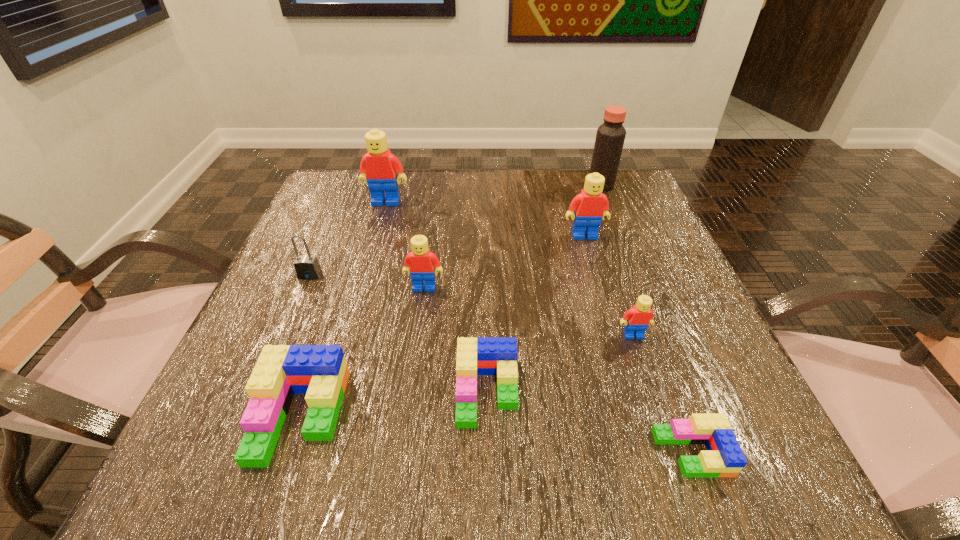
In order to click on free space that satisfies the following two spatial constraints: 1. on the face of the rightmost green Lego; 2. on the right side of the second smallest red Lego in this screenshot , I will do `click(402, 453)`.